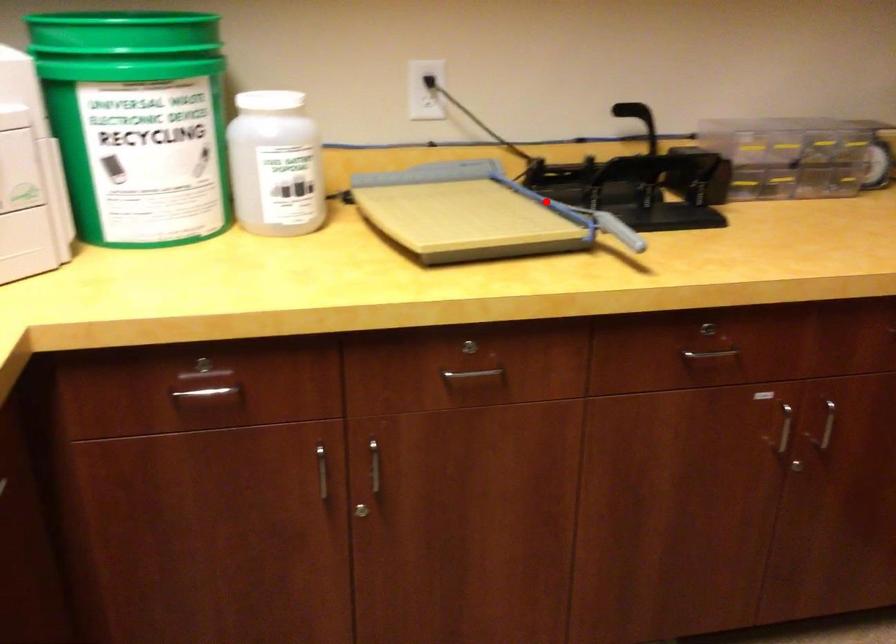
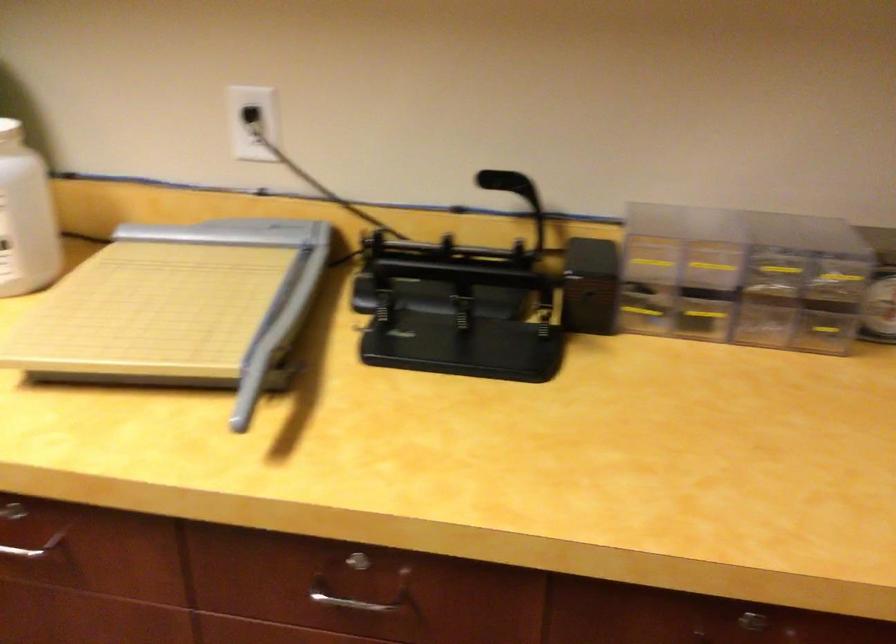
Locate, in the second image, the point that corresponds to the highlighted location in the first image.

(277, 301)